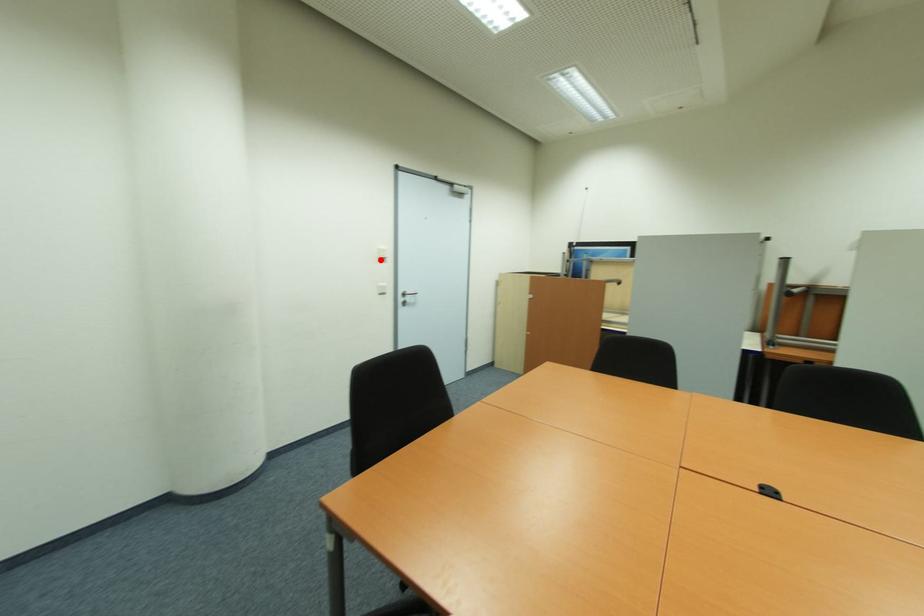
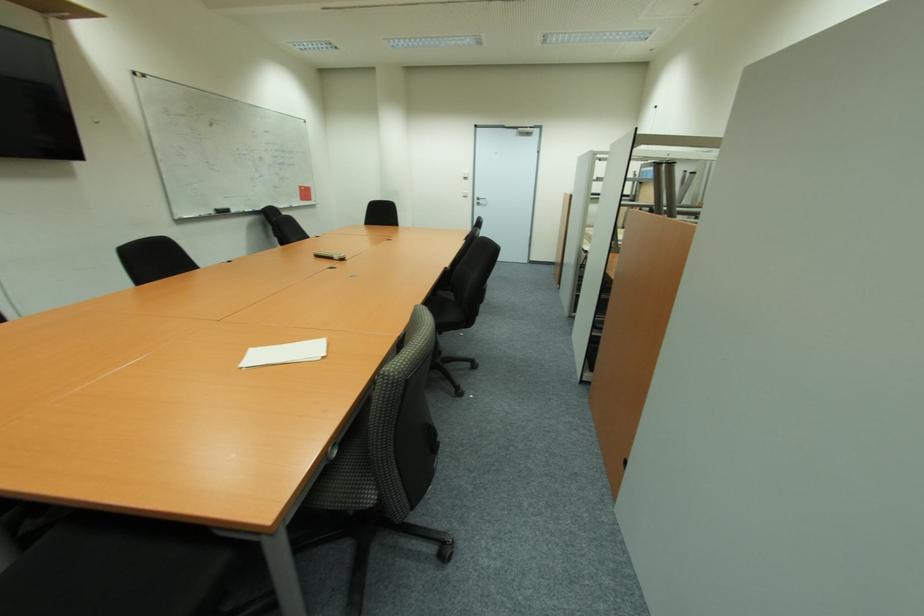
In the second image, find the point that corresponds to the highlighted location in the first image.

(467, 179)